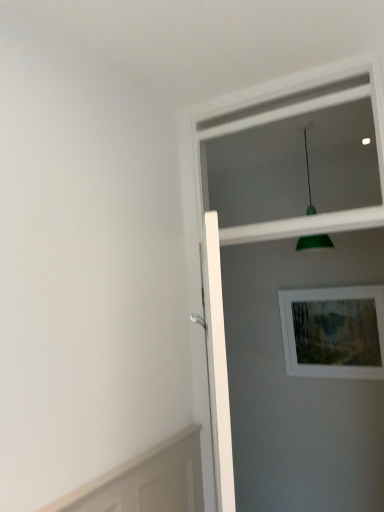
Question: Do you think green matte pendant light at upper center is within white plastic window frame at upper center, or outside of it?

Choices:
 (A) outside
 (B) inside

Answer: (A)

Question: Visually, is green matte pendant light at upper center positioned to the left or to the right of white plastic window frame at upper center?

Choices:
 (A) right
 (B) left

Answer: (A)

Question: Considering the real-world distances, which object is closest to the wooden picture frame at upper right?

Choices:
 (A) green matte pendant light at upper center
 (B) white glossy screen door at upper right
 (C) white plastic window frame at upper center

Answer: (B)

Question: Based on their relative distances, which object is farther from the wooden picture frame at upper right?

Choices:
 (A) white glossy screen door at upper right
 (B) green matte pendant light at upper center
 (C) white plastic window frame at upper center

Answer: (C)